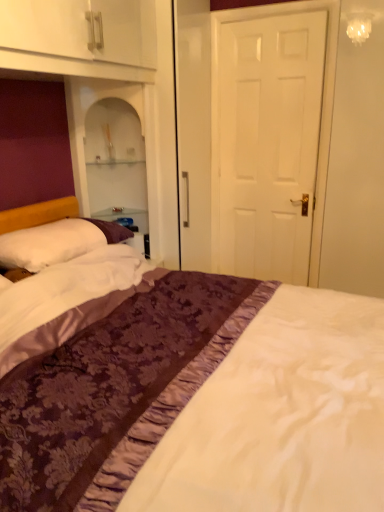
Question: Are white soft pillow at left and white matte door at center located far from each other?

Choices:
 (A) no
 (B) yes

Answer: (B)

Question: Is white soft pillow at left facing towards white matte door at center?

Choices:
 (A) yes
 (B) no

Answer: (B)

Question: Does white soft pillow at left have a greater width compared to white matte door at center?

Choices:
 (A) no
 (B) yes

Answer: (B)

Question: Considering the relative sizes of white soft pillow at left and white matte door at center in the image provided, is white soft pillow at left taller than white matte door at center?

Choices:
 (A) no
 (B) yes

Answer: (A)

Question: From a real-world perspective, is white soft pillow at left located beneath white matte door at center?

Choices:
 (A) no
 (B) yes

Answer: (B)

Question: Is the position of white soft pillow at left less distant than that of white matte door at center?

Choices:
 (A) no
 (B) yes

Answer: (B)

Question: Does white soft pillow at left have a greater width compared to purple satin bed at center?

Choices:
 (A) no
 (B) yes

Answer: (A)

Question: Is white soft pillow at left taller than purple satin bed at center?

Choices:
 (A) yes
 (B) no

Answer: (B)

Question: Can you confirm if white soft pillow at left is shorter than purple satin bed at center?

Choices:
 (A) no
 (B) yes

Answer: (B)

Question: Could you tell me if white soft pillow at left is turned towards purple satin bed at center?

Choices:
 (A) yes
 (B) no

Answer: (A)

Question: From a real-world perspective, is white soft pillow at left beneath purple satin bed at center?

Choices:
 (A) no
 (B) yes

Answer: (A)

Question: From the image's perspective, would you say white soft pillow at left is positioned over purple satin bed at center?

Choices:
 (A) no
 (B) yes

Answer: (B)

Question: Considering the relative sizes of purple satin bed at center and white matte door at center in the image provided, is purple satin bed at center taller than white matte door at center?

Choices:
 (A) yes
 (B) no

Answer: (B)